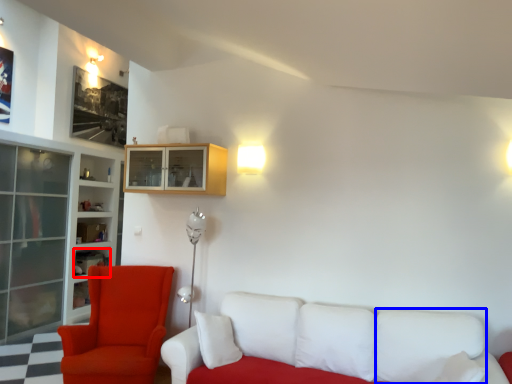
Question: Among these objects, which one is farthest to the camera, shelf (highlighted by a red box) or pillow (highlighted by a blue box)?

Choices:
 (A) shelf
 (B) pillow

Answer: (A)